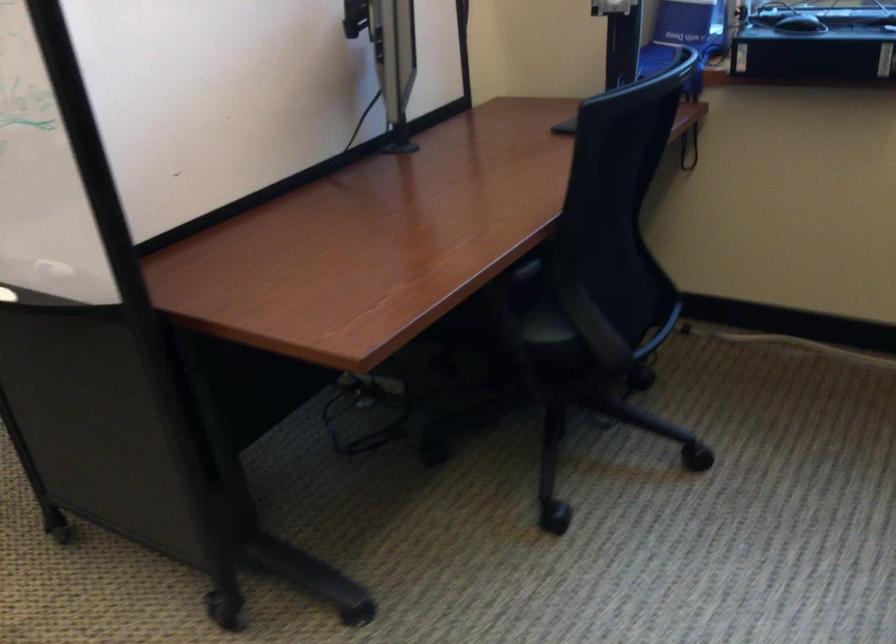
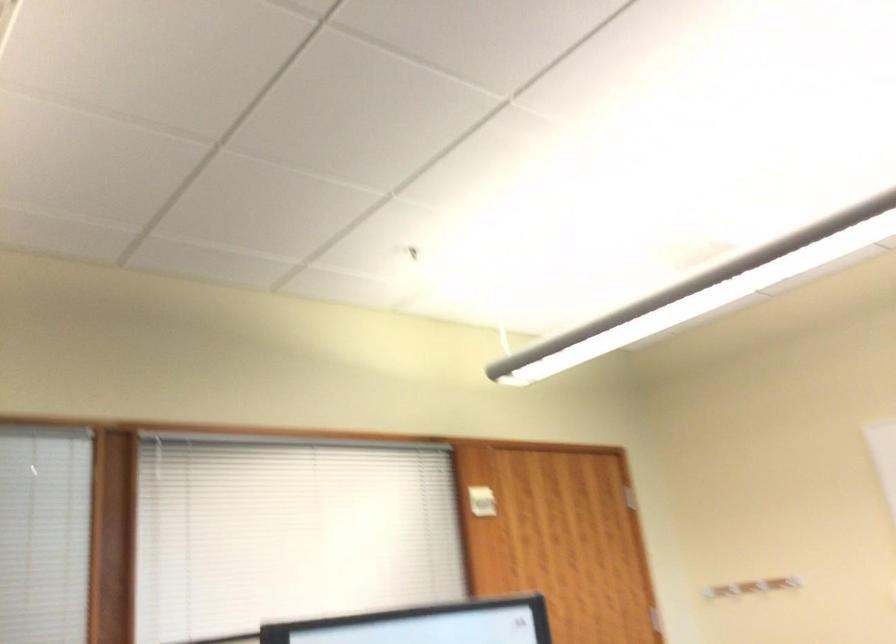
Question: The camera is either moving clockwise (left) or counter-clockwise (right) around the object. The first image is from the beginning of the video and the second image is from the end. Is the camera moving left or right when shooting the video?

Choices:
 (A) Left
 (B) Right

Answer: (B)